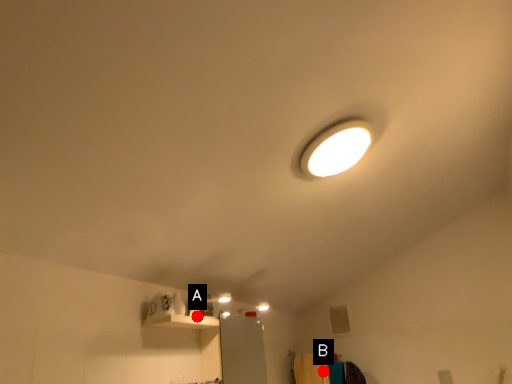
Question: Two points are circled on the image, labeled by A and B beside each circle. Which point is further to the camera?

Choices:
 (A) A is further
 (B) B is further

Answer: (B)